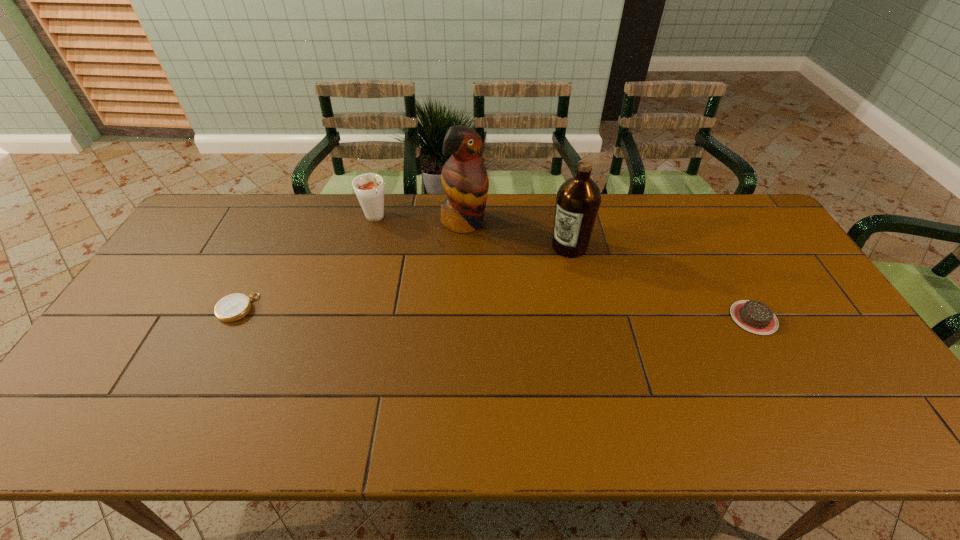
Image resolution: width=960 pixels, height=540 pixels. What are the coordinates of `object that stands as the closest to the leftmost object` in the screenshot? It's located at (369, 188).

Identify which object is the nearest to the chocolate cake. Please provide its 2D coordinates. Your answer should be formatted as a tuple, i.e. [(x, y)], where the tuple contains the x and y coordinates of a point satisfying the conditions above.

[(578, 200)]

Identify the location of vacant space that satisfies the following two spatial constraints: 1. on the front side of the second object from left to right; 2. on the right side of the fourth shortest object. (369, 246).